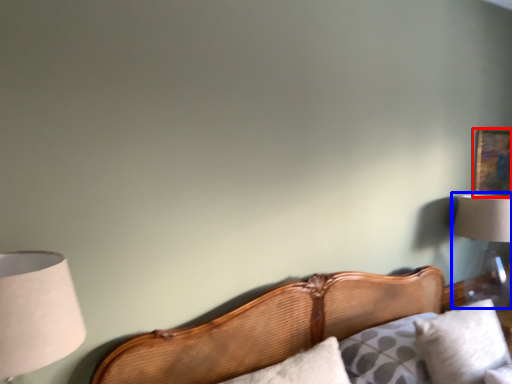
Question: Which of the following is the farthest to the observer, picture frame (highlighted by a red box) or lamp (highlighted by a blue box)?

Choices:
 (A) picture frame
 (B) lamp

Answer: (A)